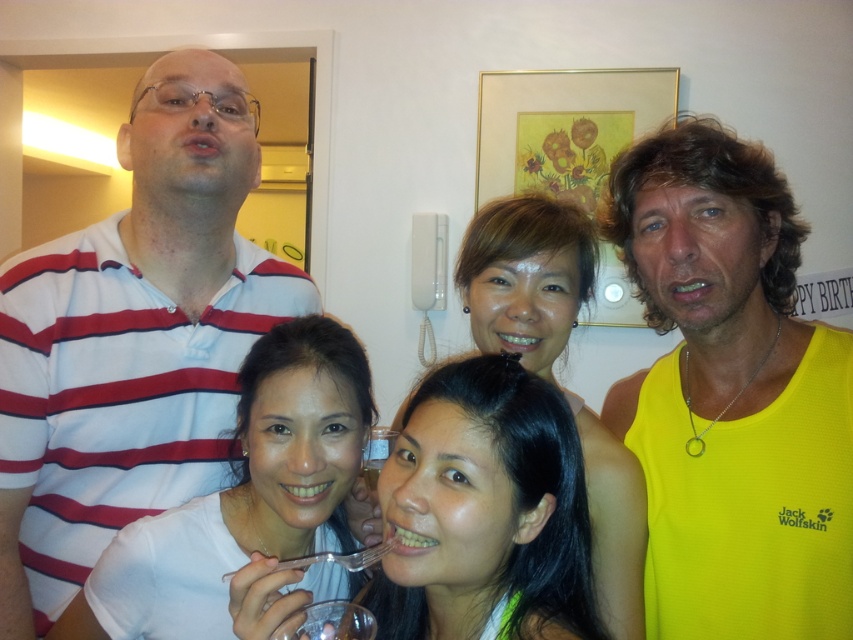
You are organizing a small party and need to arrange items on a shelf. You have a yellow fabric tank top at right and a clear plastic cup at center. Which item should you place first if you want to put the larger item on the bottom shelf?

The yellow fabric tank top at right is larger in size than the clear plastic cup at center, so you should place the yellow fabric tank top at right first on the bottom shelf.

You are a photographer adjusting the camera settings to ensure all subjects are in focus. Considering the matte yellow shirt at center and the clear plastic cup at center, which one is positioned higher in the frame?

The matte yellow shirt at center is taller than the clear plastic cup at center, so the matte yellow shirt at center is positioned higher in the frame.